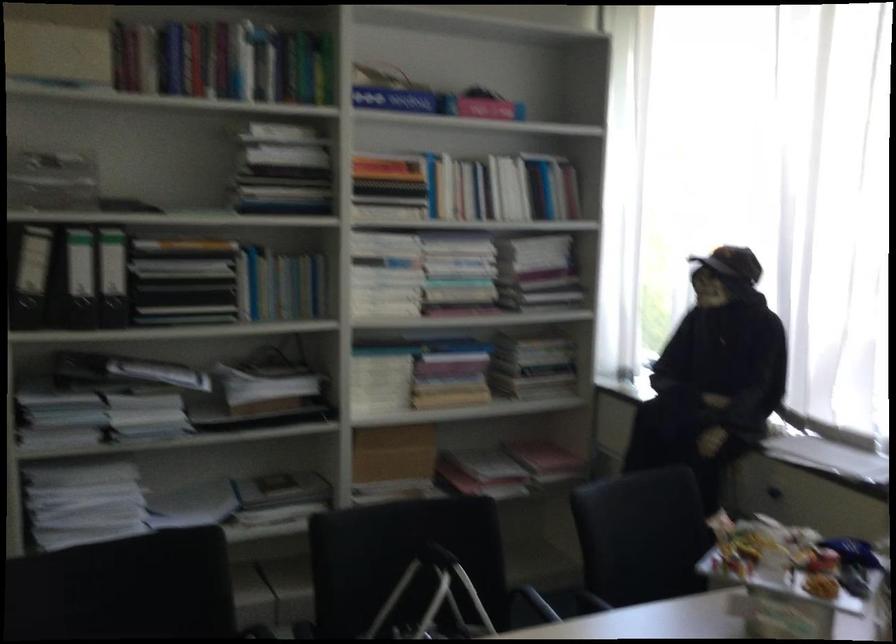
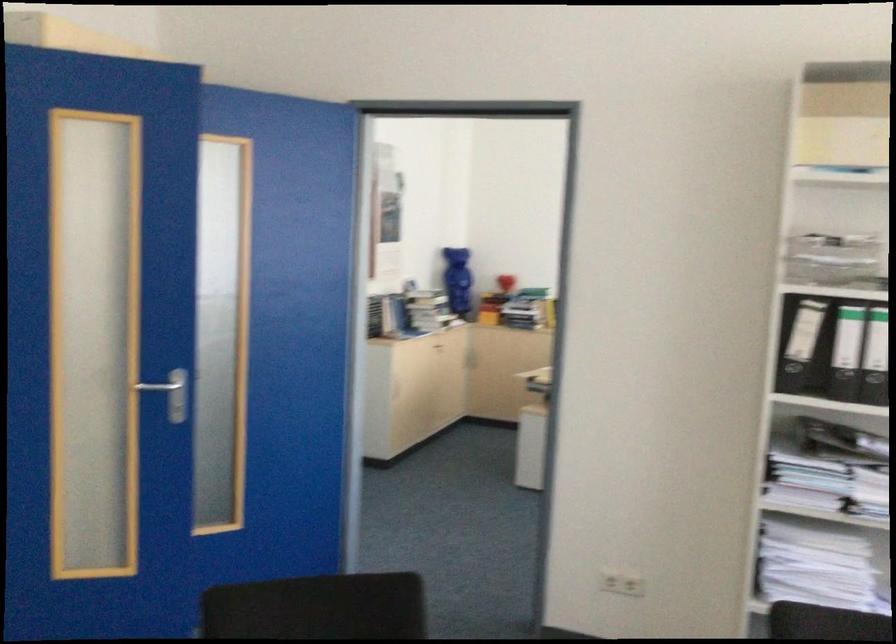
Where in the second image is the point corresponding to point (72, 187) from the first image?

(831, 258)